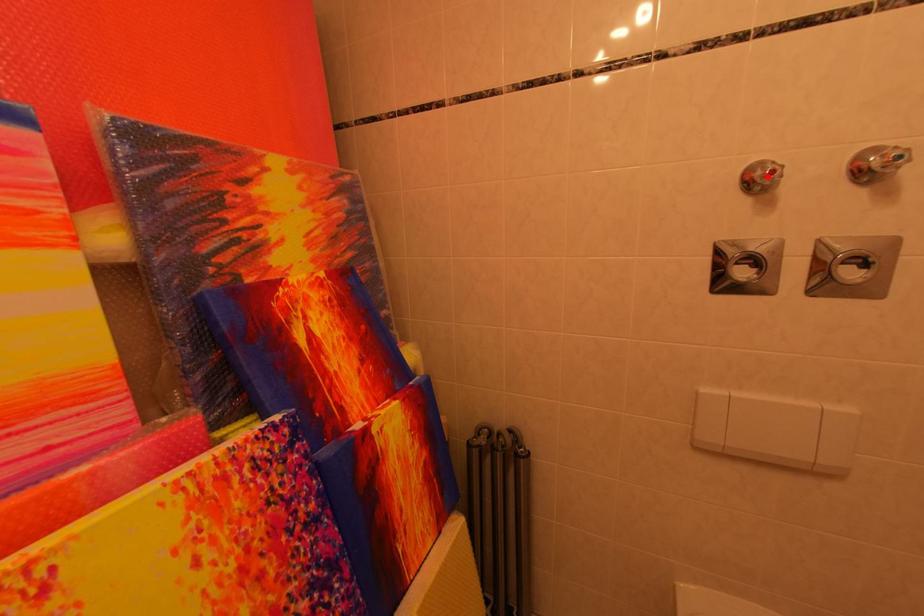
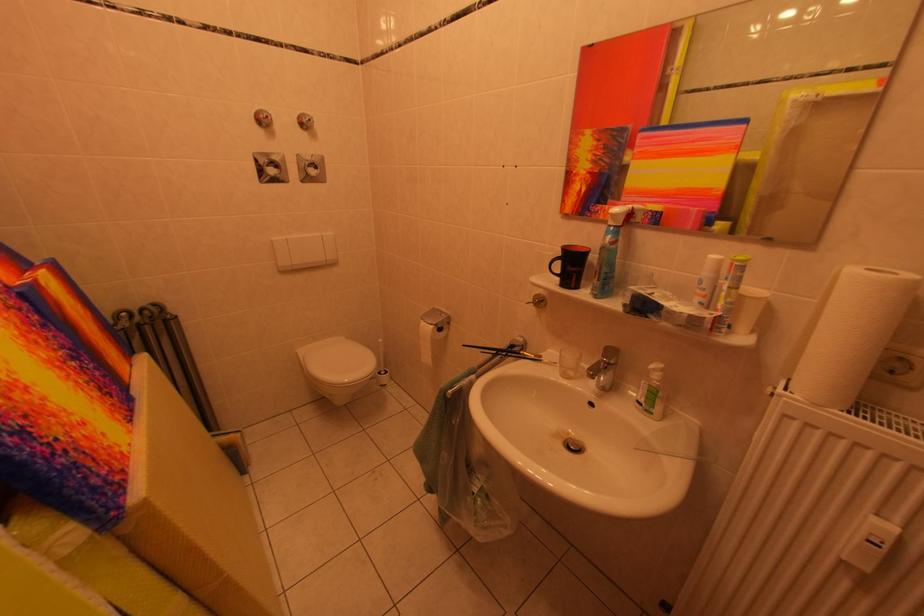
Where in the second image is the point corresponding to the highlighted location from the first image?

(271, 120)